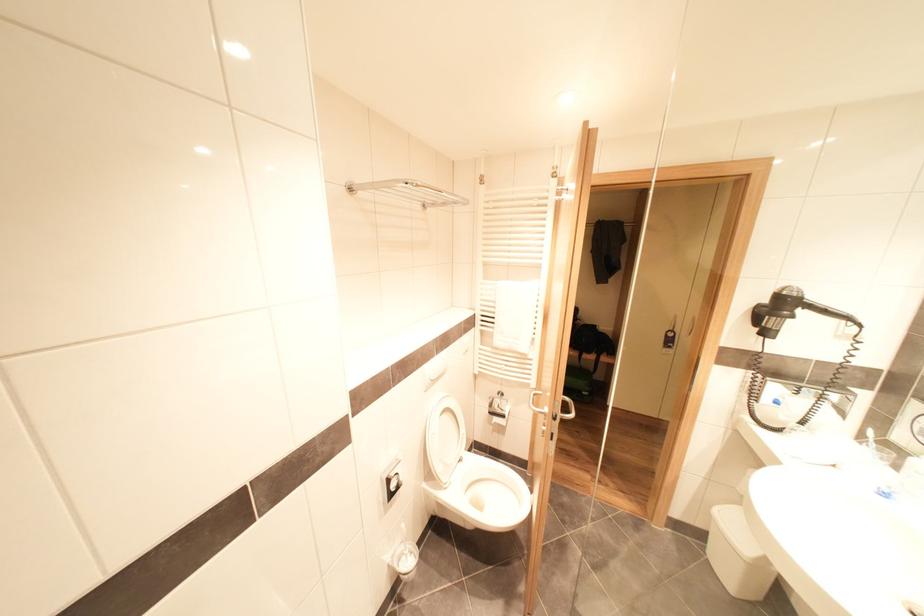
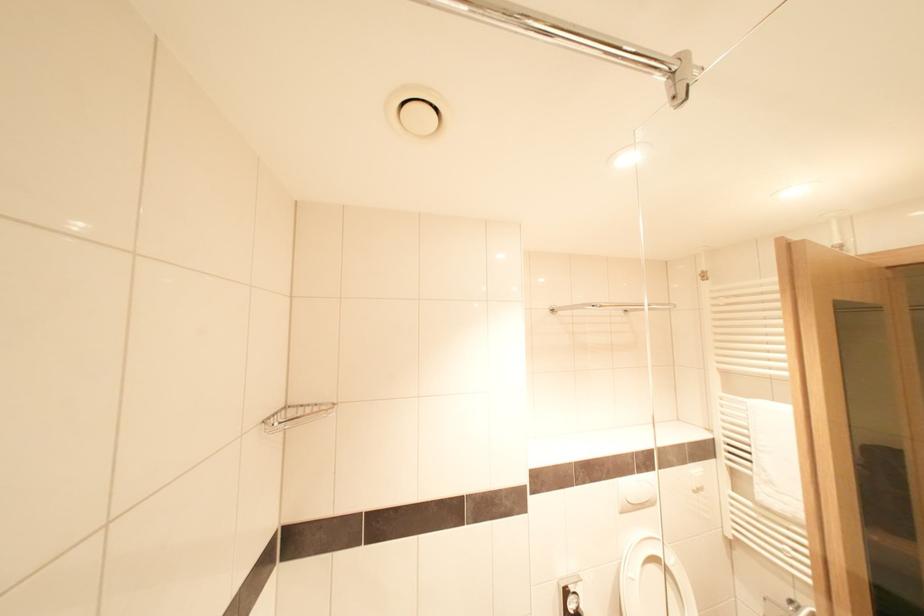
Question: How did the camera likely rotate?

Choices:
 (A) Left
 (B) Right
 (C) Up
 (D) Down

Answer: (A)